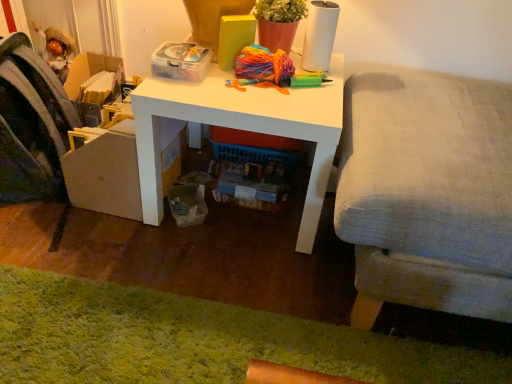
Locate an element on the screen. free spot in front of transparent plastic storage box at upper center is located at coordinates (188, 92).